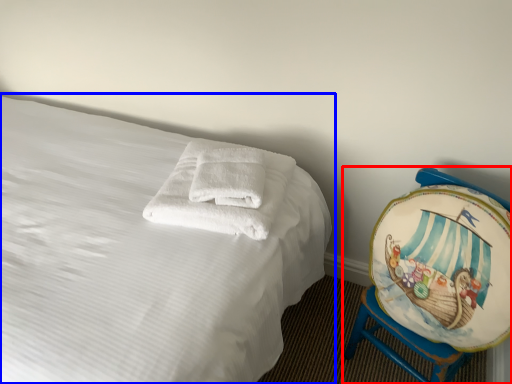
Question: Which point is closer to the camera, furniture (highlighted by a red box) or bed (highlighted by a blue box)?

Choices:
 (A) furniture
 (B) bed

Answer: (B)